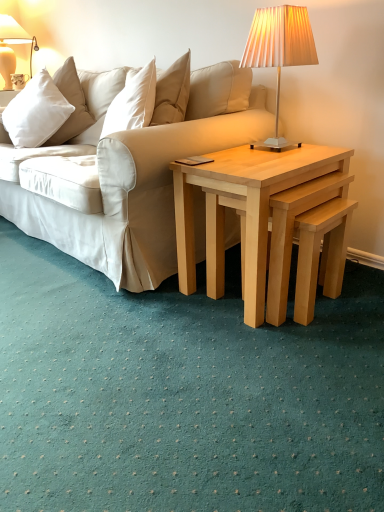
Question: In the image, is matte cream lampshade at upper right, the second lamp viewed from the top, positioned in front of or behind light wood/natural wood nesting tables at center?

Choices:
 (A) behind
 (B) front

Answer: (A)

Question: From the image's perspective, relative to light wood/natural wood nesting tables at center, is matte cream lampshade at upper right, marked as the 2th lamp in a left-to-right arrangement, above or below?

Choices:
 (A) below
 (B) above

Answer: (B)

Question: Which of these objects is positioned closest to the light wood/natural wood nesting tables at center?

Choices:
 (A) matte white lampshade at upper left, the 2th lamp viewed from the right
 (B) matte cream lampshade at upper right, the second lamp viewed from the top
 (C) white soft cushion at upper left

Answer: (B)

Question: Based on their relative distances, which object is farther from the matte white lampshade at upper left, which is counted as the second lamp, starting from the bottom?

Choices:
 (A) matte cream lampshade at upper right, the second lamp viewed from the top
 (B) light wood/natural wood nesting tables at center
 (C) white soft cushion at upper left

Answer: (B)